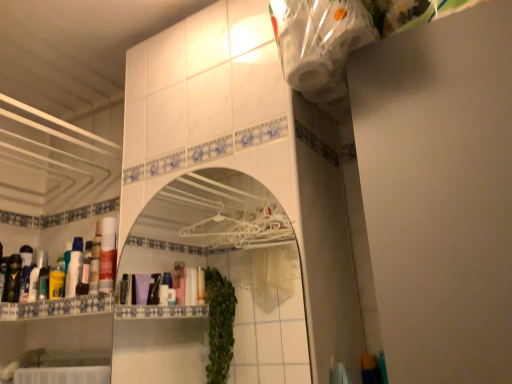
Question: From a real-world perspective, is white glossy cabinet at lower center above or below white plastic mirror at center?

Choices:
 (A) above
 (B) below

Answer: (B)

Question: From the image's perspective, is white glossy cabinet at lower center located above or below white plastic mirror at center?

Choices:
 (A) above
 (B) below

Answer: (B)

Question: Considering the real-world distances, which object is closest to the yellow glossy mouthwash at left, marked as the first mouthwash in a left-to-right arrangement?

Choices:
 (A) white glossy bottle at left, which is counted as the 2th mouthwash, starting from the right
 (B) white glossy cabinet at lower center
 (C) metallic gold toiletry at left, the third toiletry positioned from the right
 (D) white glossy bottle at left, marked as the first toiletry in a right-to-left arrangement
 (E) white plastic mirror at center

Answer: (A)

Question: Which is nearer to the metallic gold toiletry at left, which is counted as the 1th toiletry, starting from the left?

Choices:
 (A) white plastic mirror at center
 (B) white glossy bottle at left, which appears as the second mouthwash when viewed from the left
 (C) yellow glossy mouthwash at left, which is counted as the 3th mouthwash, starting from the right
 (D) white glossy bottle at left, arranged as the third toiletry when viewed from the left
 (E) white glossy cabinet at lower center

Answer: (D)